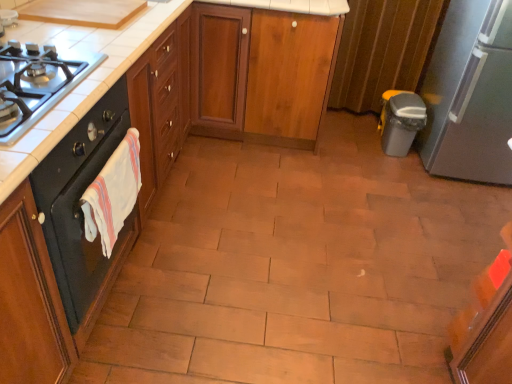
Question: Would you say white cotton hand towel at left is outside black matte gas stove at left?

Choices:
 (A) no
 (B) yes

Answer: (B)

Question: Are white cotton hand towel at left and black matte gas stove at left located far from each other?

Choices:
 (A) yes
 (B) no

Answer: (B)

Question: Can you confirm if white cotton hand towel at left is smaller than black matte gas stove at left?

Choices:
 (A) no
 (B) yes

Answer: (B)

Question: Is white cotton hand towel at left to the left of black matte gas stove at left from the viewer's perspective?

Choices:
 (A) no
 (B) yes

Answer: (A)

Question: Is white cotton hand towel at left touching black matte gas stove at left?

Choices:
 (A) no
 (B) yes

Answer: (A)

Question: Considering the positions of point (94, 74) and point (134, 223), is point (94, 74) closer or farther from the camera than point (134, 223)?

Choices:
 (A) closer
 (B) farther

Answer: (A)

Question: Looking at the image, does wooden cabinet at center, placed as the first cabinetry when sorted from front to back, seem bigger or smaller compared to black matte oven at left?

Choices:
 (A) small
 (B) big

Answer: (B)

Question: Considering their positions, is wooden cabinet at center, placed as the first cabinetry when sorted from front to back, located in front of or behind black matte oven at left?

Choices:
 (A) behind
 (B) front

Answer: (B)

Question: Is wooden cabinet at center, placed as the first cabinetry when sorted from front to back, wider or thinner than black matte oven at left?

Choices:
 (A) thin
 (B) wide

Answer: (B)

Question: In the image, is black matte gas stove at left on the left side or the right side of black matte oven at left?

Choices:
 (A) right
 (B) left

Answer: (B)

Question: Choose the correct answer: Is black matte gas stove at left inside black matte oven at left or outside it?

Choices:
 (A) inside
 (B) outside

Answer: (B)

Question: In terms of height, does black matte gas stove at left look taller or shorter compared to black matte oven at left?

Choices:
 (A) tall
 (B) short

Answer: (B)

Question: Based on their sizes in the image, would you say black matte gas stove at left is bigger or smaller than black matte oven at left?

Choices:
 (A) small
 (B) big

Answer: (A)

Question: Is wooden cabinet at center, the 1th cabinetry when ordered from back to front, situated inside black matte oven at left or outside?

Choices:
 (A) inside
 (B) outside

Answer: (B)

Question: Considering the positions of wooden cabinet at center, the 1th cabinetry when ordered from back to front, and black matte oven at left in the image, is wooden cabinet at center, the 1th cabinetry when ordered from back to front, bigger or smaller than black matte oven at left?

Choices:
 (A) small
 (B) big

Answer: (B)